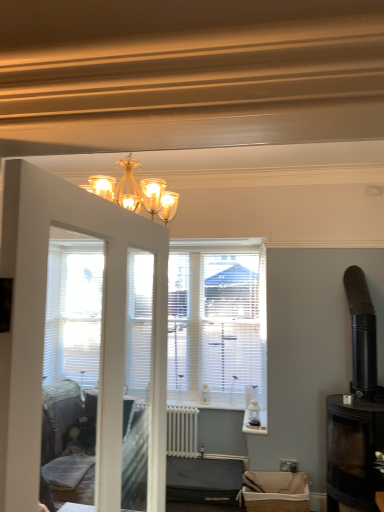
Question: Is black glass fireplace at right positioned behind burlap basket at lower center, the first furniture positioned from the front?

Choices:
 (A) yes
 (B) no

Answer: (B)

Question: Is black glass fireplace at right positioned in front of burlap basket at lower center, the first furniture positioned from the front?

Choices:
 (A) no
 (B) yes

Answer: (B)

Question: Is black glass fireplace at right smaller than burlap basket at lower center, which ranks as the 2th furniture in left-to-right order?

Choices:
 (A) yes
 (B) no

Answer: (B)

Question: From a real-world perspective, is black glass fireplace at right on top of burlap basket at lower center, which ranks as the 2th furniture in left-to-right order?

Choices:
 (A) yes
 (B) no

Answer: (A)

Question: Is burlap basket at lower center, marked as the 2th furniture in a back-to-front arrangement, at the back of black glass fireplace at right?

Choices:
 (A) no
 (B) yes

Answer: (A)

Question: Choose the correct answer: Is white painted radiator at center inside black glass fireplace at right or outside it?

Choices:
 (A) inside
 (B) outside

Answer: (B)

Question: Considering the positions of white painted radiator at center and black glass fireplace at right in the image, is white painted radiator at center wider or thinner than black glass fireplace at right?

Choices:
 (A) wide
 (B) thin

Answer: (B)

Question: Is white painted radiator at center bigger or smaller than black glass fireplace at right?

Choices:
 (A) big
 (B) small

Answer: (B)

Question: Would you say white painted radiator at center is to the left or to the right of black glass fireplace at right in the picture?

Choices:
 (A) left
 (B) right

Answer: (A)

Question: Looking at their shapes, would you say burlap basket at lower center, placed as the first furniture when sorted from right to left, is wider or thinner than gold metallic chandelier at upper center?

Choices:
 (A) wide
 (B) thin

Answer: (B)

Question: From the image's perspective, is burlap basket at lower center, the first furniture positioned from the front, positioned above or below gold metallic chandelier at upper center?

Choices:
 (A) below
 (B) above

Answer: (A)

Question: Which is correct: burlap basket at lower center, placed as the first furniture when sorted from right to left, is inside gold metallic chandelier at upper center, or outside of it?

Choices:
 (A) outside
 (B) inside

Answer: (A)

Question: Considering the positions of burlap basket at lower center, which ranks as the 2th furniture in left-to-right order, and gold metallic chandelier at upper center in the image, is burlap basket at lower center, which ranks as the 2th furniture in left-to-right order, taller or shorter than gold metallic chandelier at upper center?

Choices:
 (A) short
 (B) tall

Answer: (A)

Question: From the image's perspective, relative to black glass fireplace at right, is dark gray fabric sofa at lower center, the 1th furniture from the back, above or below?

Choices:
 (A) below
 (B) above

Answer: (A)

Question: Considering the relative positions of dark gray fabric sofa at lower center, which appears as the first furniture when viewed from the left, and black glass fireplace at right in the image provided, is dark gray fabric sofa at lower center, which appears as the first furniture when viewed from the left, to the left or to the right of black glass fireplace at right?

Choices:
 (A) left
 (B) right

Answer: (A)